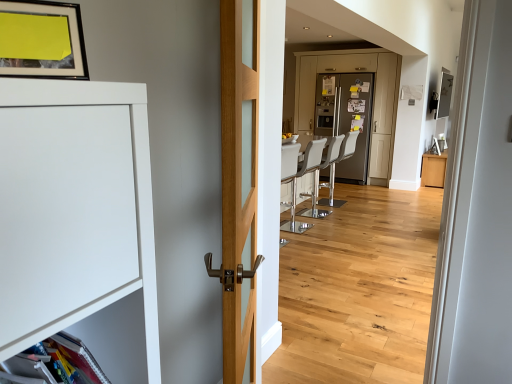
Question: Is matte black picture frame at upper left at the right side of silver metallic refrigerator at center, marked as the first screen door in a right-to-left arrangement?

Choices:
 (A) yes
 (B) no

Answer: (B)

Question: Considering the relative sizes of matte black picture frame at upper left and silver metallic refrigerator at center, marked as the first screen door in a right-to-left arrangement, in the image provided, is matte black picture frame at upper left bigger than silver metallic refrigerator at center, marked as the first screen door in a right-to-left arrangement,?

Choices:
 (A) yes
 (B) no

Answer: (B)

Question: Is matte black picture frame at upper left at the left side of silver metallic refrigerator at center, arranged as the second screen door when viewed from the left?

Choices:
 (A) no
 (B) yes

Answer: (B)

Question: Does matte black picture frame at upper left have a greater height compared to silver metallic refrigerator at center, arranged as the second screen door when viewed from the left?

Choices:
 (A) yes
 (B) no

Answer: (B)

Question: Is matte black picture frame at upper left surrounding silver metallic refrigerator at center, arranged as the second screen door when viewed from the left?

Choices:
 (A) yes
 (B) no

Answer: (B)

Question: Is matte black picture frame at upper left completely or partially outside of silver metallic refrigerator at center, marked as the first screen door in a right-to-left arrangement?

Choices:
 (A) no
 (B) yes

Answer: (B)

Question: Could satin silver refrigerator at center, positioned as the first screen door in left-to-right order, be considered to be inside white leather barstool at center, the 3th armchair in the front-to-back sequence?

Choices:
 (A) yes
 (B) no

Answer: (B)

Question: From the image's perspective, is white leather barstool at center, the 3th armchair in the front-to-back sequence, under satin silver refrigerator at center, arranged as the second screen door when viewed from the right?

Choices:
 (A) no
 (B) yes

Answer: (B)

Question: Does white leather barstool at center, acting as the 1th armchair starting from the back, have a lesser height compared to satin silver refrigerator at center, arranged as the second screen door when viewed from the right?

Choices:
 (A) no
 (B) yes

Answer: (B)

Question: Can you confirm if white leather barstool at center, the 3th armchair in the front-to-back sequence, is bigger than satin silver refrigerator at center, arranged as the second screen door when viewed from the right?

Choices:
 (A) no
 (B) yes

Answer: (A)

Question: Is white leather barstool at center, the 3th armchair in the front-to-back sequence, taller than satin silver refrigerator at center, positioned as the first screen door in left-to-right order?

Choices:
 (A) no
 (B) yes

Answer: (A)

Question: Considering the relative sizes of white leather barstool at center, the 3th armchair in the front-to-back sequence, and satin silver refrigerator at center, arranged as the second screen door when viewed from the right, in the image provided, is white leather barstool at center, the 3th armchair in the front-to-back sequence, wider than satin silver refrigerator at center, arranged as the second screen door when viewed from the right,?

Choices:
 (A) yes
 (B) no

Answer: (B)

Question: Is white leather barstool at center, acting as the 1th armchair starting from the back, bigger than wooden floor at center?

Choices:
 (A) no
 (B) yes

Answer: (A)